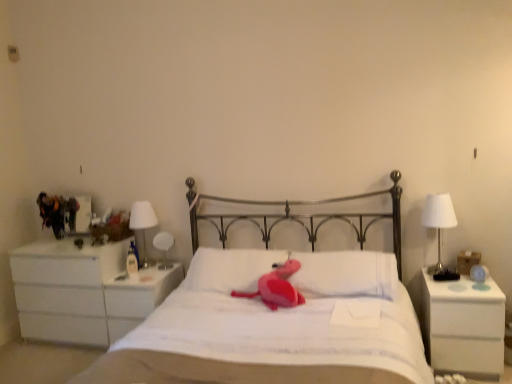
This screenshot has height=384, width=512. I want to click on free space above white matte nightstand at right, which appears as the second nightstand when viewed from the left (from a real-world perspective), so click(x=459, y=288).